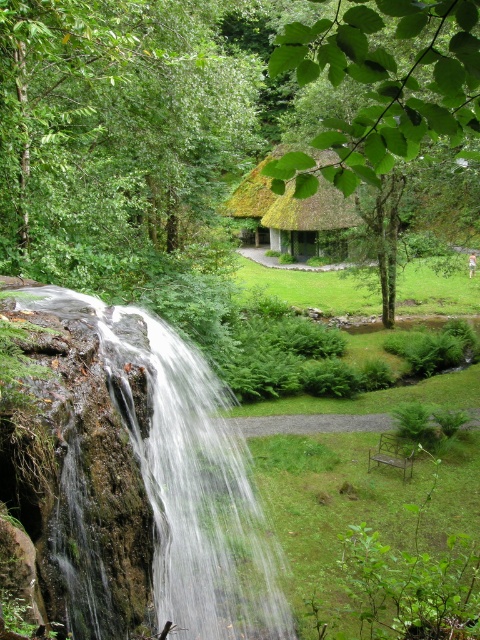
You are standing in the middle of the scene and want to take a photo of both the green leafy tree at upper left and the thatched roof hut at center. Which direction should you face to include both in your camera frame?

You should face to the left to include both the green leafy tree at upper left and the thatched roof hut at center in your camera frame since the green leafy tree at upper left is positioned on the left side of thatched roof hut at center.

You are standing in the serene natural setting with the waterfall and the thatched roof building. You notice two points marked in the image. The first point is at coordinates point (86, 86) and the second is at point (380, 74). If you were to walk towards both points, which one would you reach first?

You would reach point (86, 86) first because it is closer to you than point (380, 74), which is further away based on their positions in the scene.